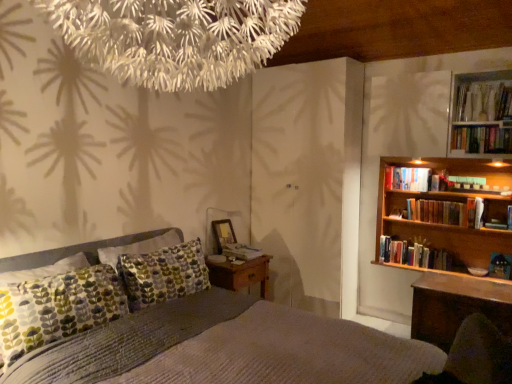
At what (x,y) coordinates should I click in order to perform the action: click on free spot below hardcover books at upper right, acting as the first book starting from the top (from a real-world perspective). Please return your answer as a coordinate pair (x, y). Looking at the image, I should click on (467, 281).